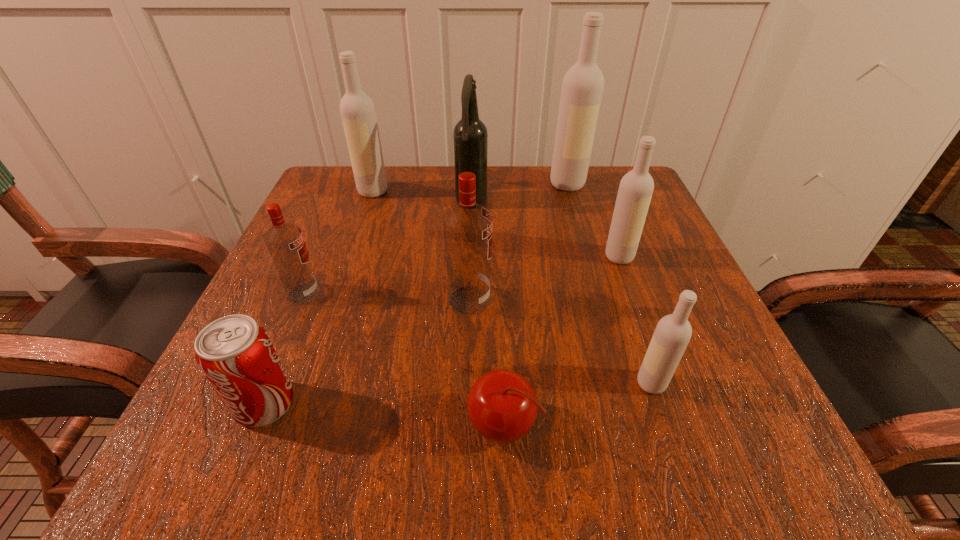
The image size is (960, 540). Find the location of `unoccupied position between the smallest white vodka and the left red vodka`. unoccupied position between the smallest white vodka and the left red vodka is located at coordinates (477, 339).

This screenshot has height=540, width=960. In order to click on unoccupied position between the red soda can and the third smallest white vodka in this screenshot , I will do `click(319, 298)`.

Find the location of a particular element. The height and width of the screenshot is (540, 960). blank region between the eighth tallest object and the nearest white vodka is located at coordinates click(x=458, y=394).

Locate an element on the screen. free space between the eighth tallest object and the left red vodka is located at coordinates (284, 349).

In order to click on vacant area between the third biggest white vodka and the shortest object in this screenshot , I will do `click(561, 341)`.

The height and width of the screenshot is (540, 960). I want to click on object that is the third nearest to the soda can, so click(502, 406).

Where is `the seventh closest object relative to the third farthest white vodka`? The image size is (960, 540). the seventh closest object relative to the third farthest white vodka is located at coordinates (285, 242).

Where is `vodka that is the second nearest to the second shortest object`? vodka that is the second nearest to the second shortest object is located at coordinates (468, 226).

The height and width of the screenshot is (540, 960). I want to click on vodka that stands as the fifth closest to the smaller red vodka, so click(582, 88).

Identify which white vodka is located as the nearest to the leftmost white vodka. Please provide its 2D coordinates. Your answer should be formatted as a tuple, i.e. [(x, y)], where the tuple contains the x and y coordinates of a point satisfying the conditions above.

[(582, 88)]